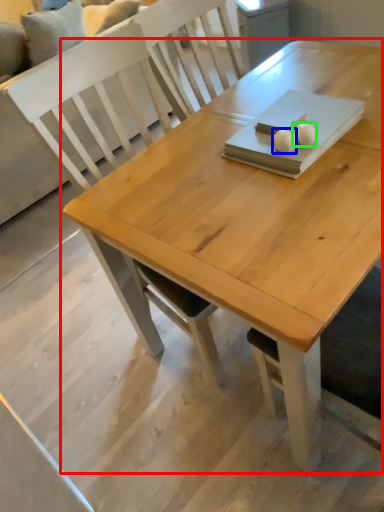
Question: Which object is positioned farthest from table (highlighted by a red box)? Select from food (highlighted by a blue box) and food (highlighted by a green box).

Choices:
 (A) food
 (B) food

Answer: (B)